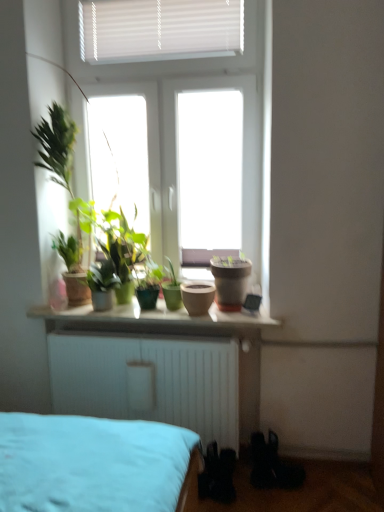
Question: Considering the relative sizes of matte clay pot at center, the second flowerpot in the right-to-left sequence, and matte brown pot at center, acting as the first flowerpot starting from the right, in the image provided, is matte clay pot at center, the second flowerpot in the right-to-left sequence, taller than matte brown pot at center, acting as the first flowerpot starting from the right,?

Choices:
 (A) yes
 (B) no

Answer: (B)

Question: From the image's perspective, does matte clay pot at center, the second flowerpot in the right-to-left sequence, appear higher than matte brown pot at center, the second flowerpot positioned from the left?

Choices:
 (A) yes
 (B) no

Answer: (B)

Question: Is matte clay pot at center, the second flowerpot in the right-to-left sequence, to the right of matte brown pot at center, acting as the first flowerpot starting from the right, from the viewer's perspective?

Choices:
 (A) no
 (B) yes

Answer: (A)

Question: Considering the relative positions of matte clay pot at center, the second flowerpot in the right-to-left sequence, and matte brown pot at center, acting as the first flowerpot starting from the right, in the image provided, is matte clay pot at center, the second flowerpot in the right-to-left sequence, behind matte brown pot at center, acting as the first flowerpot starting from the right,?

Choices:
 (A) no
 (B) yes

Answer: (A)

Question: Is matte clay pot at center, which is counted as the 1th flowerpot, starting from the left, facing away from matte brown pot at center, the second flowerpot positioned from the left?

Choices:
 (A) no
 (B) yes

Answer: (A)

Question: From the image's perspective, is matte clay pot at center, the second flowerpot in the right-to-left sequence, located beneath matte brown pot at center, acting as the first flowerpot starting from the right?

Choices:
 (A) yes
 (B) no

Answer: (A)

Question: From the image's perspective, is green matte plant at center, arranged as the 2th houseplant when viewed from the right, under black matte shoe at lower right?

Choices:
 (A) no
 (B) yes

Answer: (A)

Question: Is black matte shoe at lower right located within green matte plant at center, arranged as the 2th houseplant when viewed from the right?

Choices:
 (A) no
 (B) yes

Answer: (A)

Question: Is green matte plant at center, arranged as the 2th houseplant when viewed from the right, further to camera compared to black matte shoe at lower right?

Choices:
 (A) no
 (B) yes

Answer: (B)

Question: Is green matte plant at center, which ranks as the 1th houseplant in left-to-right order, not near black matte shoe at lower right?

Choices:
 (A) no
 (B) yes

Answer: (B)

Question: Is green matte plant at center, arranged as the 2th houseplant when viewed from the right, next to black matte shoe at lower right and touching it?

Choices:
 (A) yes
 (B) no

Answer: (B)

Question: Can you confirm if green matte plant at center, arranged as the 2th houseplant when viewed from the right, is positioned to the right of black matte shoe at lower right?

Choices:
 (A) yes
 (B) no

Answer: (B)

Question: From a real-world perspective, is matte brown pot at center, the second flowerpot positioned from the left, physically below matte ceramic pots at center?

Choices:
 (A) yes
 (B) no

Answer: (B)